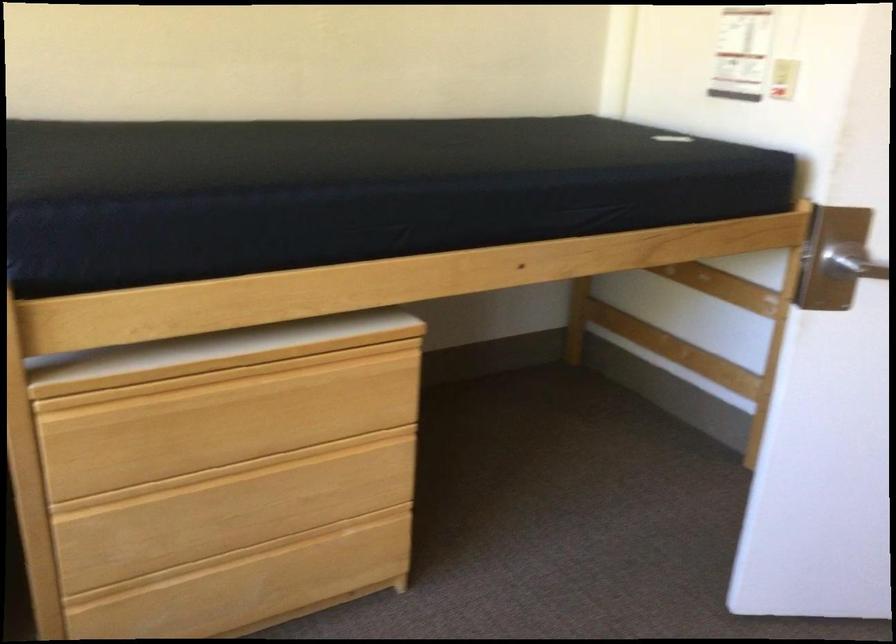
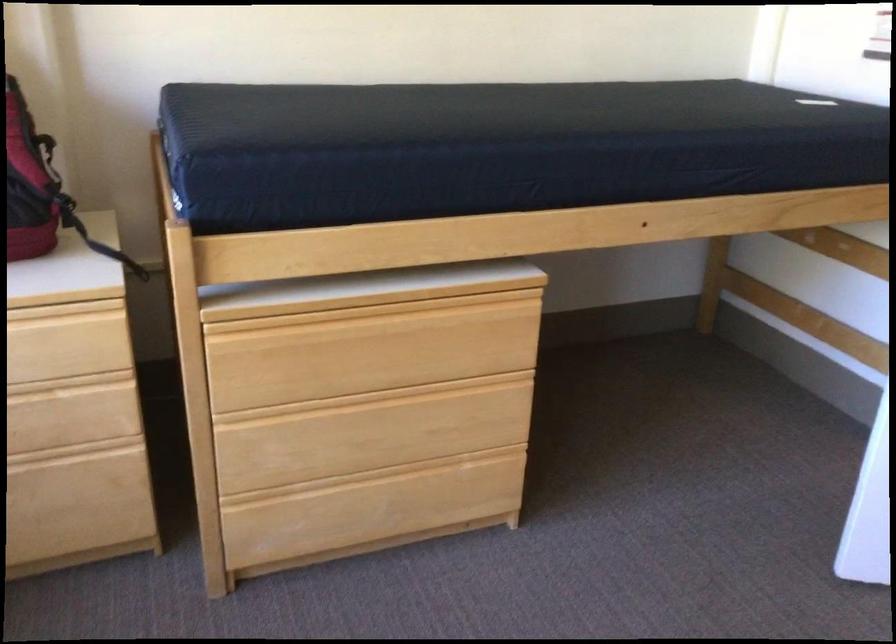
Question: Which direction would the cameraman need to move to produce the second image? Reply with the corresponding letter.

Choices:
 (A) Left
 (B) Right
 (C) Forward
 (D) Backward

Answer: (D)